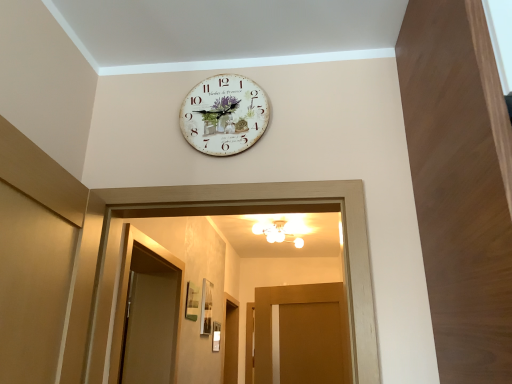
What do you see at coordinates (304, 334) in the screenshot? I see `matte wood door at center` at bounding box center [304, 334].

At what (x,y) coordinates should I click in order to perform the action: click on matte wood door at center. Please return your answer as a coordinate pair (x, y). The image size is (512, 384). Looking at the image, I should click on (304, 334).

Considering the relative sizes of white glossy chandelier at upper center and matte wood door at center in the image provided, is white glossy chandelier at upper center wider than matte wood door at center?

Yes, white glossy chandelier at upper center is wider than matte wood door at center.

In terms of size, does white glossy chandelier at upper center appear bigger or smaller than matte wood door at center?

In the image, white glossy chandelier at upper center appears to be smaller than matte wood door at center.

Is point (280, 241) closer to viewer compared to point (319, 323)?

That is False.

Image resolution: width=512 pixels, height=384 pixels. Find the location of `light fixture behind the matte wood door at center`. light fixture behind the matte wood door at center is located at coordinates (276, 233).

From a real-world perspective, is white painted wood clock at upper center positioned above or below white glossy chandelier at upper center?

white painted wood clock at upper center is below white glossy chandelier at upper center.

You are a GUI agent. You are given a task and a screenshot of the screen. Output one action in this format:
    pyautogui.click(x=<x>, y=<y>)
    Task: Click on the light fixture that is above the white painted wood clock at upper center (from a real-world perspective)
    Image resolution: width=512 pixels, height=384 pixels.
    Given the screenshot: What is the action you would take?
    pyautogui.click(x=276, y=233)

Can you confirm if white painted wood clock at upper center is thinner than white glossy chandelier at upper center?

Indeed, white painted wood clock at upper center has a lesser width compared to white glossy chandelier at upper center.

Is white painted wood clock at upper center looking in the opposite direction of white glossy chandelier at upper center?

Yes, white painted wood clock at upper center's orientation is away from white glossy chandelier at upper center.

From the image's perspective, is white glossy chandelier at upper center positioned above or below white painted wood clock at upper center?

white glossy chandelier at upper center is below white painted wood clock at upper center.

Does white glossy chandelier at upper center lie behind white painted wood clock at upper center?

Yes, it is.

In terms of width, does white glossy chandelier at upper center look wider or thinner when compared to white painted wood clock at upper center?

Considering their sizes, white glossy chandelier at upper center looks broader than white painted wood clock at upper center.

Looking at this image, does white painted wood clock at upper center have a lesser height compared to matte wood door at center?

Yes.

Which is farther from the camera, (263,108) or (293,376)?

Point (293,376)

I want to click on door behind the white painted wood clock at upper center, so click(x=304, y=334).

Is matte wood door at center directly adjacent to white glossy chandelier at upper center?

No, matte wood door at center is not beside white glossy chandelier at upper center.

Find the location of a particular element. This screenshot has height=384, width=512. door on the right of white glossy chandelier at upper center is located at coordinates (304, 334).

Is matte wood door at center to the left or to the right of white glossy chandelier at upper center in the image?

In the image, matte wood door at center appears on the right side of white glossy chandelier at upper center.

Considering the relative sizes of matte wood door at center and white glossy chandelier at upper center in the image provided, is matte wood door at center wider than white glossy chandelier at upper center?

Incorrect, the width of matte wood door at center does not surpass that of white glossy chandelier at upper center.

Between matte wood door at center and white painted wood clock at upper center, which one has more height?

matte wood door at center is taller.

Could you tell me if matte wood door at center is turned towards white painted wood clock at upper center?

Yes, matte wood door at center faces towards white painted wood clock at upper center.

Does matte wood door at center have a larger size compared to white painted wood clock at upper center?

Indeed, matte wood door at center has a larger size compared to white painted wood clock at upper center.

From a real-world perspective, between matte wood door at center and white painted wood clock at upper center, who is vertically lower?

From a 3D spatial view, matte wood door at center is below.

Locate an element on the screen. This screenshot has width=512, height=384. door below the white glossy chandelier at upper center (from a real-world perspective) is located at coordinates (304, 334).

You are a GUI agent. You are given a task and a screenshot of the screen. Output one action in this format:
    pyautogui.click(x=<x>, y=<y>)
    Task: Click on the wall clock lying above the white glossy chandelier at upper center (from the image's perspective)
    The width and height of the screenshot is (512, 384).
    Given the screenshot: What is the action you would take?
    pyautogui.click(x=224, y=115)

Consider the image. When comparing their distances from white painted wood clock at upper center, does white glossy chandelier at upper center or matte wood door at center seem further?

white glossy chandelier at upper center is positioned further to the anchor white painted wood clock at upper center.

Which object lies nearer to the anchor point white glossy chandelier at upper center, white painted wood clock at upper center or matte wood door at center?

Among the two, matte wood door at center is located nearer to white glossy chandelier at upper center.

Looking at the image, which one is located further to white painted wood clock at upper center, matte wood door at center or white glossy chandelier at upper center?

Based on the image, white glossy chandelier at upper center appears to be further to white painted wood clock at upper center.

Looking at this image, looking at the image, which one is located further to matte wood door at center, white glossy chandelier at upper center or white painted wood clock at upper center?

white painted wood clock at upper center is further to matte wood door at center.

Considering their positions, is matte wood door at center positioned closer to white glossy chandelier at upper center than white painted wood clock at upper center?

matte wood door at center.

Estimate the real-world distances between objects in this image. Which object is further from matte wood door at center, white painted wood clock at upper center or white glossy chandelier at upper center?

white painted wood clock at upper center lies further to matte wood door at center than the other object.

Locate an element on the screen. The height and width of the screenshot is (384, 512). door between white painted wood clock at upper center and white glossy chandelier at upper center along the z-axis is located at coordinates (304, 334).